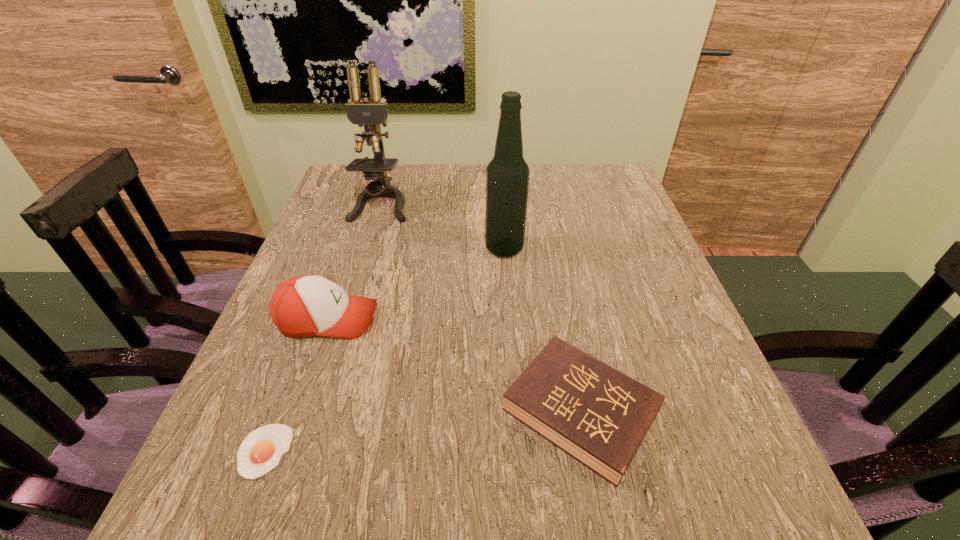
The width and height of the screenshot is (960, 540). Find the location of `object present at the near right corner`. object present at the near right corner is located at coordinates (596, 414).

The width and height of the screenshot is (960, 540). Find the location of `vacant area at the far edge of the desktop`. vacant area at the far edge of the desktop is located at coordinates (533, 186).

What are the coordinates of `free space at the near edge` in the screenshot? It's located at (643, 514).

In the image, there is a desktop. Where is `vacant space at the left edge`? vacant space at the left edge is located at coordinates (328, 249).

Find the location of a particular element. The height and width of the screenshot is (540, 960). free region at the right edge is located at coordinates (641, 268).

In the image, there is a desktop. Where is `free space at the far left corner`? This screenshot has height=540, width=960. free space at the far left corner is located at coordinates (357, 191).

I want to click on blank space at the near left corner of the desktop, so click(x=289, y=489).

Locate an element on the screen. The image size is (960, 540). vacant region at the far right corner of the desktop is located at coordinates (591, 173).

Find the location of a particular element. The image size is (960, 540). empty location between the alcohol and the farthest object is located at coordinates (443, 226).

The image size is (960, 540). Identify the location of vacant area that lies between the second farthest object and the hardback book. click(x=542, y=330).